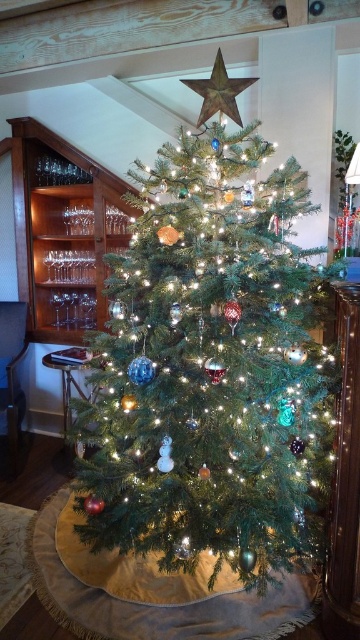
Between green matte christmas tree at center and metallic gold star at upper center, which one is positioned higher?

Positioned higher is metallic gold star at upper center.

Who is more distant from viewer, (213, 131) or (222, 100)?

Point (222, 100)

Locate an element on the screen. The image size is (360, 640). green matte christmas tree at center is located at coordinates (210, 368).